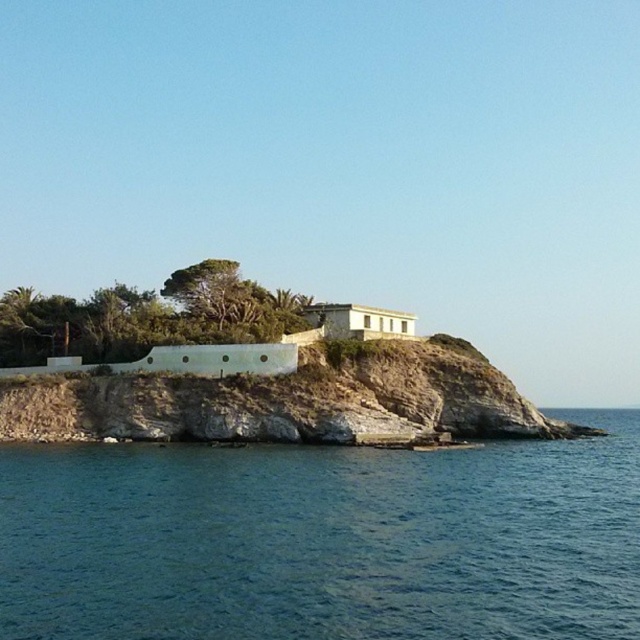
You are planning to build a small garden between the blue water at lower left and the brown rocky cliff at center. Considering their widths, which area would be more suitable for a garden that requires more space?

The brown rocky cliff at center has a greater width than the blue water at lower left, making it more suitable for a garden that requires more space.

Based on the photo, you are standing at the base of the brown rocky cliff at center and want to reach the blue water at lower left. Which direction should you move in to get there?

You should move downward towards the blue water at lower left since it is located below the brown rocky cliff at center.